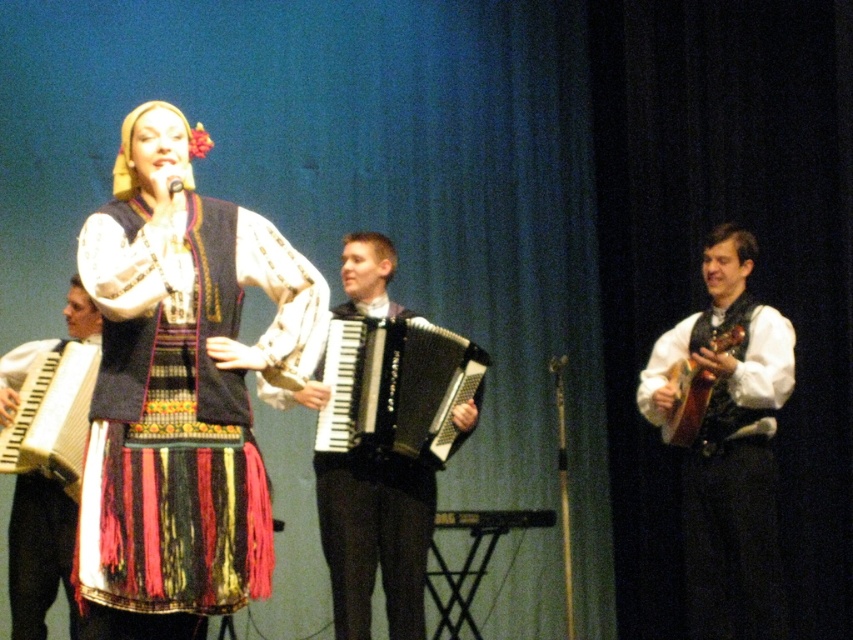
Question: Does black matte accordion at center appear on the right side of wooden accordion at left?

Choices:
 (A) yes
 (B) no

Answer: (A)

Question: Based on their relative distances, which object is farther from the matte black vest at right?

Choices:
 (A) black matte accordion at center
 (B) black glossy accordion at center
 (C) wooden accordion at center

Answer: (C)

Question: Is matte black vest at right closer to camera compared to wooden accordion at center?

Choices:
 (A) no
 (B) yes

Answer: (A)

Question: Which point is farther to the camera?

Choices:
 (A) (354, 528)
 (B) (62, 500)
 (C) (224, 243)
 (D) (381, 330)

Answer: (D)

Question: Which point is closer to the camera taking this photo?

Choices:
 (A) (786, 397)
 (B) (314, 374)
 (C) (119, 584)

Answer: (C)

Question: Is matte black vest at right smaller than wooden accordion at center?

Choices:
 (A) no
 (B) yes

Answer: (A)